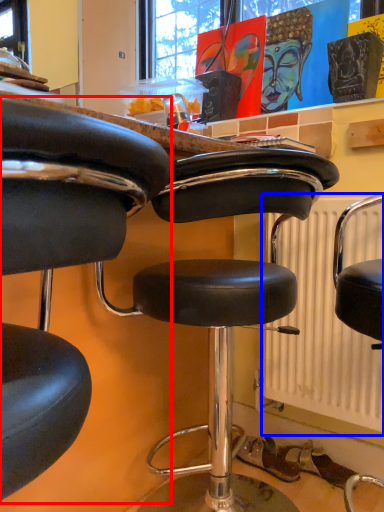
Question: Which object is further to the camera taking this photo, chair (highlighted by a red box) or radiator (highlighted by a blue box)?

Choices:
 (A) chair
 (B) radiator

Answer: (B)